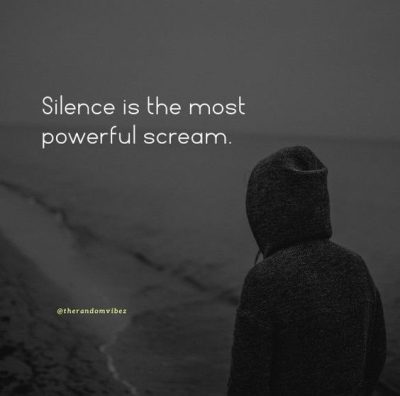
The image size is (400, 396). What are the coordinates of `right corner edge` in the screenshot? It's located at (384, 4).